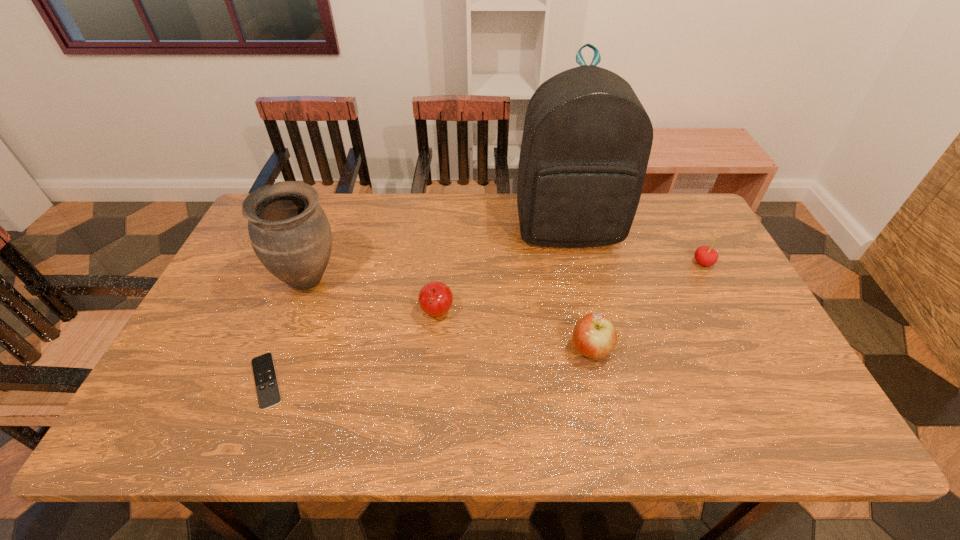
In order to click on vacant space at the left edge of the desktop in this screenshot , I will do `click(248, 342)`.

In the image, there is a desktop. Identify the location of free region at the right edge. (714, 307).

Find the location of a particular element. vacant area at the near left corner is located at coordinates (150, 414).

You are a GUI agent. You are given a task and a screenshot of the screen. Output one action in this format:
    pyautogui.click(x=<x>, y=<y>)
    Task: Click on the blank region between the nearer cherry and the shortest object
    
    Given the screenshot: What is the action you would take?
    pyautogui.click(x=351, y=348)

Find the location of a particular element. The width and height of the screenshot is (960, 540). empty location between the apple and the rightmost object is located at coordinates (647, 306).

In order to click on vacant area between the farther cherry and the backpack in this screenshot , I will do `click(636, 246)`.

The width and height of the screenshot is (960, 540). In order to click on empty space that is in between the rightmost object and the third object from left to right in this screenshot , I will do `click(570, 288)`.

Find the location of a particular element. vacant area that lies between the urn and the apple is located at coordinates (449, 314).

Image resolution: width=960 pixels, height=540 pixels. Find the location of `free space between the nearer cherry and the urn`. free space between the nearer cherry and the urn is located at coordinates (372, 296).

Identify the location of empty space that is in between the urn and the shortest object. This screenshot has width=960, height=540. (288, 330).